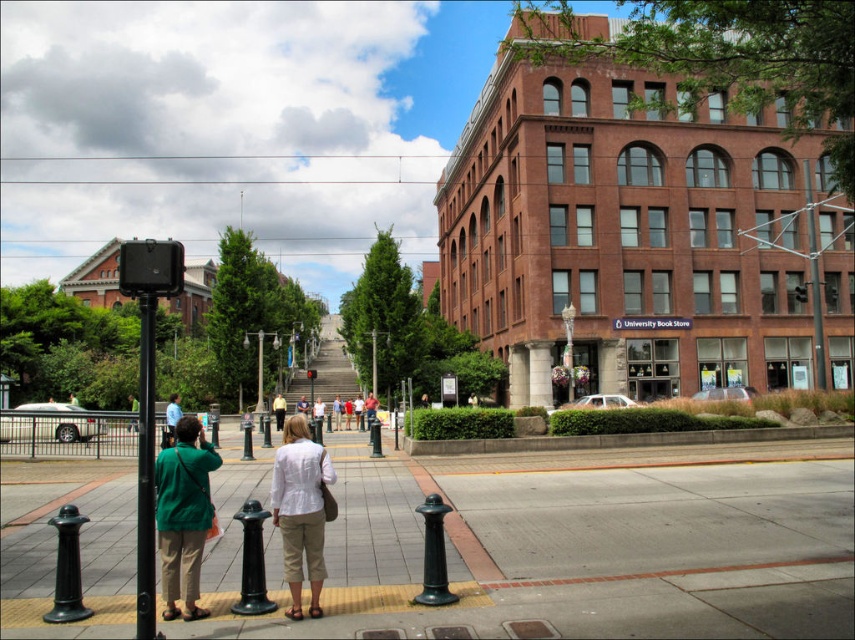
You are a delivery person needing to place a package on the sidewalk between the two people. The coordinates for the drop point are given as point [183,515]. Based on the scene, which object is located at this coordinate?

The point [183,515] corresponds to the green matte jacket at lower left.

You are a delivery drone flying above the urban scene. You need to land on the smooth concrete sidewalk at center while avoiding the green matte jacket at lower left. Can you safely land there?

The smooth concrete sidewalk at center is closer to the viewer than the green matte jacket at lower left, so the drone can safely land there as the sidewalk is nearer and the jacket is further away.